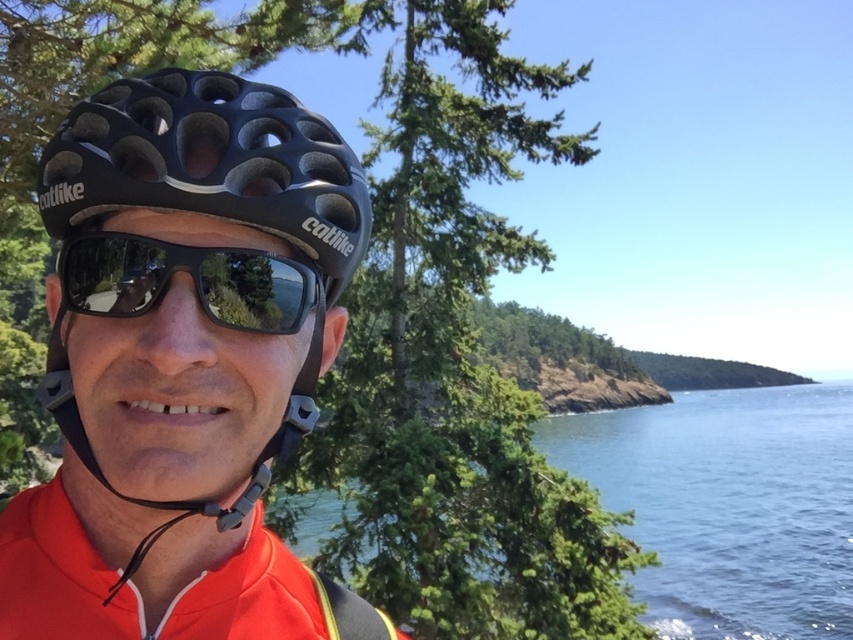
From the picture: Does black matte bicycle helmet at center appear under black matte sunglasses at center?

Actually, black matte bicycle helmet at center is above black matte sunglasses at center.

Between point (45, 211) and point (86, 308), which one is positioned behind?

Positioned behind is point (45, 211).

Locate an element on the screen. The image size is (853, 640). black matte bicycle helmet at center is located at coordinates (196, 246).

Is blue liquid water at center taller than black matte sunglasses at center?

Correct, blue liquid water at center is much taller as black matte sunglasses at center.

Is point (827, 608) farther from camera compared to point (276, 260)?

Yes, point (827, 608) is farther from viewer.

Who is more forward, (711, 593) or (235, 275)?

Point (235, 275) is more forward.

Where is `blue liquid water at center`? The image size is (853, 640). blue liquid water at center is located at coordinates (728, 506).

Describe the element at coordinates (196, 246) in the screenshot. Image resolution: width=853 pixels, height=640 pixels. I see `black matte bicycle helmet at center` at that location.

Who is positioned more to the right, black matte bicycle helmet at center or blue liquid water at center?

Positioned to the right is blue liquid water at center.

Is point (335, 138) in front of point (653, 586)?

That is True.

Where is `black matte bicycle helmet at center`? The height and width of the screenshot is (640, 853). black matte bicycle helmet at center is located at coordinates click(196, 246).